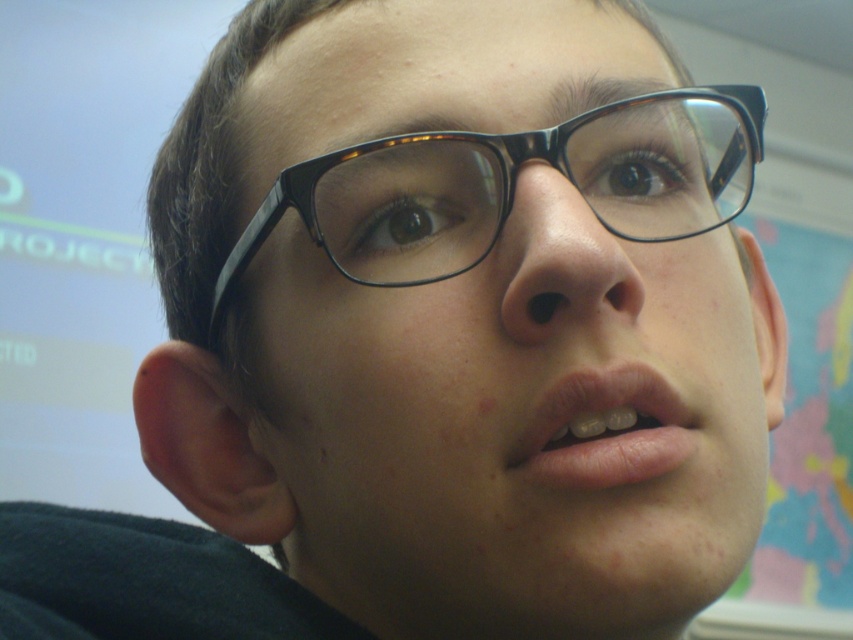
Question: Which point appears closest to the camera in this image?

Choices:
 (A) (479, 252)
 (B) (538, 426)
 (C) (515, 244)
 (D) (535, 212)

Answer: (B)

Question: Does black plastic glasses at center appear over pink matte lips at center?

Choices:
 (A) yes
 (B) no

Answer: (A)

Question: Does tortoiseshell/black frame glasses at center have a smaller size compared to pink matte lips at center?

Choices:
 (A) no
 (B) yes

Answer: (A)

Question: Does tortoiseshell/black frame glasses at center appear over pink matte lips at center?

Choices:
 (A) no
 (B) yes

Answer: (B)

Question: Which of these objects is positioned farthest from the tortoiseshell/black frame glasses at center?

Choices:
 (A) black plastic glasses at center
 (B) matte skin nose at center

Answer: (B)

Question: Which is farther from the matte skin nose at center?

Choices:
 (A) pink matte lips at center
 (B) black plastic glasses at center
 (C) tortoiseshell/black frame glasses at center

Answer: (B)